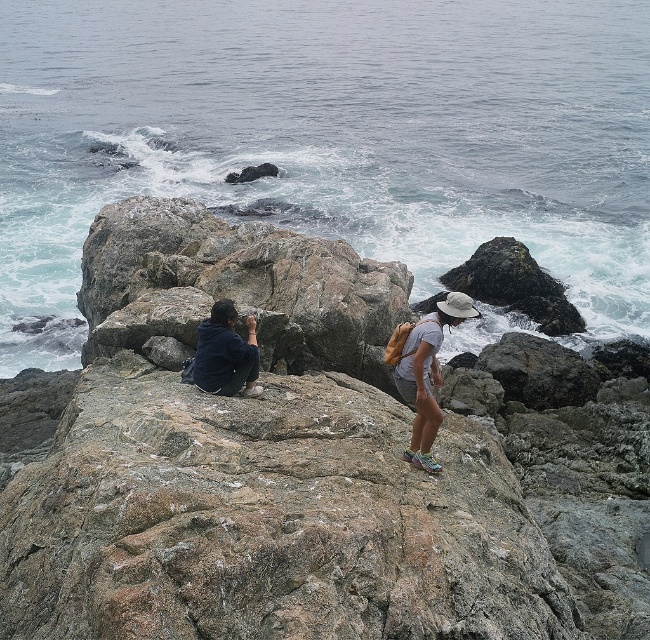
Question: Estimate the real-world distances between objects in this image. Which object is closer to the matte gray shorts at center?

Choices:
 (A) dark blue shirt at center
 (B) rough textured rock at center

Answer: (B)

Question: Observing the image, what is the correct spatial positioning of rough textured rock at center in reference to dark blue shirt at center?

Choices:
 (A) left
 (B) right

Answer: (B)

Question: Which object is closer to the camera taking this photo?

Choices:
 (A) white frothy water at upper center
 (B) rough textured rock at center

Answer: (B)

Question: Does white frothy water at upper center have a greater width compared to dark blue shirt at center?

Choices:
 (A) no
 (B) yes

Answer: (B)

Question: Which object appears closest to the camera in this image?

Choices:
 (A) rough textured rock at center
 (B) white frothy water at upper center
 (C) matte gray shorts at center

Answer: (A)

Question: Does dark blue jacket at center appear over dark blue shirt at center?

Choices:
 (A) no
 (B) yes

Answer: (A)